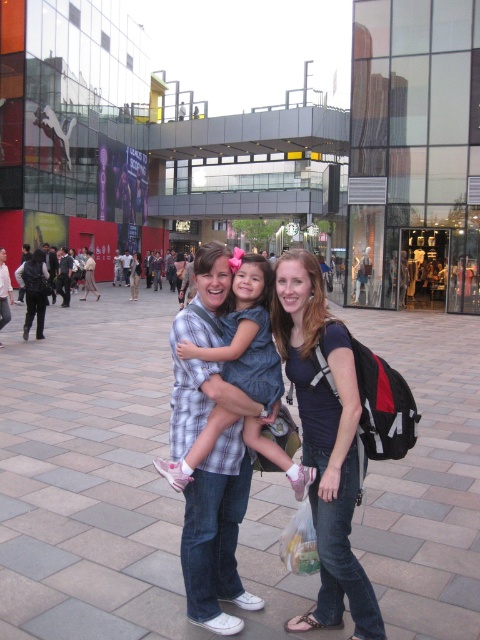
Is point (117, 134) positioned behind point (340, 324)?

Yes.

Between glass building at center and matte blue shirt at center, which one has more height?

glass building at center

Is point (429, 173) positioned in front of point (337, 616)?

That is False.

I want to click on glass building at center, so click(254, 150).

Does matte blue shirt at center have a lesser height compared to plaid fabric dress at center?

Incorrect, matte blue shirt at center's height does not fall short of plaid fabric dress at center's.

Who is positioned more to the left, matte blue shirt at center or plaid fabric dress at center?

From the viewer's perspective, plaid fabric dress at center appears more on the left side.

This screenshot has height=640, width=480. Identify the location of matte blue shirt at center. (324, 442).

Where is `matte blue shirt at center`? Image resolution: width=480 pixels, height=640 pixels. matte blue shirt at center is located at coordinates (324, 442).

Who is positioned more to the left, glass building at center or plaid fabric dress at center?

glass building at center is more to the left.

Does glass building at center have a smaller size compared to plaid fabric dress at center?

Incorrect, glass building at center is not smaller in size than plaid fabric dress at center.

Does point (79, 60) lie behind point (241, 301)?

That is True.

Identify the location of glass building at center. This screenshot has width=480, height=640. [254, 150].